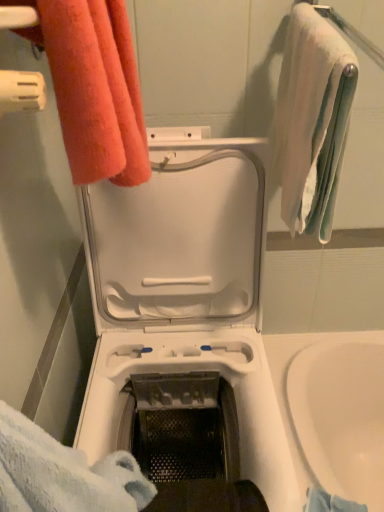
Question: Can you confirm if white soft towel at upper right, arranged as the second towel when viewed from the left, is smaller than orange terry cloth towel at upper left, the second towel in the right-to-left sequence?

Choices:
 (A) no
 (B) yes

Answer: (A)

Question: Is white soft towel at upper right, arranged as the second towel when viewed from the left, looking in the opposite direction of orange terry cloth towel at upper left, positioned as the 1th towel in left-to-right order?

Choices:
 (A) no
 (B) yes

Answer: (B)

Question: Is white soft towel at upper right, arranged as the second towel when viewed from the left, to the right of orange terry cloth towel at upper left, positioned as the 1th towel in left-to-right order, from the viewer's perspective?

Choices:
 (A) yes
 (B) no

Answer: (A)

Question: Does white soft towel at upper right, arranged as the second towel when viewed from the left, have a lesser width compared to orange terry cloth towel at upper left, the second towel in the right-to-left sequence?

Choices:
 (A) yes
 (B) no

Answer: (B)

Question: Is white soft towel at upper right, which is counted as the 1th towel, starting from the right, with orange terry cloth towel at upper left, the second towel in the right-to-left sequence?

Choices:
 (A) yes
 (B) no

Answer: (B)

Question: Considering the positions of point (142, 167) and point (193, 145), is point (142, 167) closer or farther from the camera than point (193, 145)?

Choices:
 (A) farther
 (B) closer

Answer: (B)

Question: From a real-world perspective, is orange terry cloth towel at upper left, the second towel in the right-to-left sequence, physically located above or below white plastic washing machine at center?

Choices:
 (A) below
 (B) above

Answer: (B)

Question: Considering their positions, is orange terry cloth towel at upper left, the second towel in the right-to-left sequence, located in front of or behind white plastic washing machine at center?

Choices:
 (A) front
 (B) behind

Answer: (B)

Question: Would you say orange terry cloth towel at upper left, positioned as the 1th towel in left-to-right order, is to the left or to the right of white plastic washing machine at center in the picture?

Choices:
 (A) right
 (B) left

Answer: (B)

Question: From a real-world perspective, is white plastic washing machine at center physically located above or below orange terry cloth towel at upper left, the second towel in the right-to-left sequence?

Choices:
 (A) above
 (B) below

Answer: (B)

Question: Is white plastic washing machine at center inside the boundaries of orange terry cloth towel at upper left, positioned as the 1th towel in left-to-right order, or outside?

Choices:
 (A) outside
 (B) inside

Answer: (A)

Question: Considering the positions of white plastic washing machine at center and orange terry cloth towel at upper left, positioned as the 1th towel in left-to-right order, in the image, is white plastic washing machine at center bigger or smaller than orange terry cloth towel at upper left, positioned as the 1th towel in left-to-right order,?

Choices:
 (A) small
 (B) big

Answer: (B)

Question: Would you say white plastic washing machine at center is to the left or to the right of orange terry cloth towel at upper left, positioned as the 1th towel in left-to-right order, in the picture?

Choices:
 (A) right
 (B) left

Answer: (A)

Question: From the image's perspective, is white soft towel at upper right, which is counted as the 1th towel, starting from the right, positioned above or below white plastic washing machine at center?

Choices:
 (A) above
 (B) below

Answer: (A)

Question: Is point 302,92 positioned closer to the camera than point 240,484?

Choices:
 (A) closer
 (B) farther

Answer: (A)